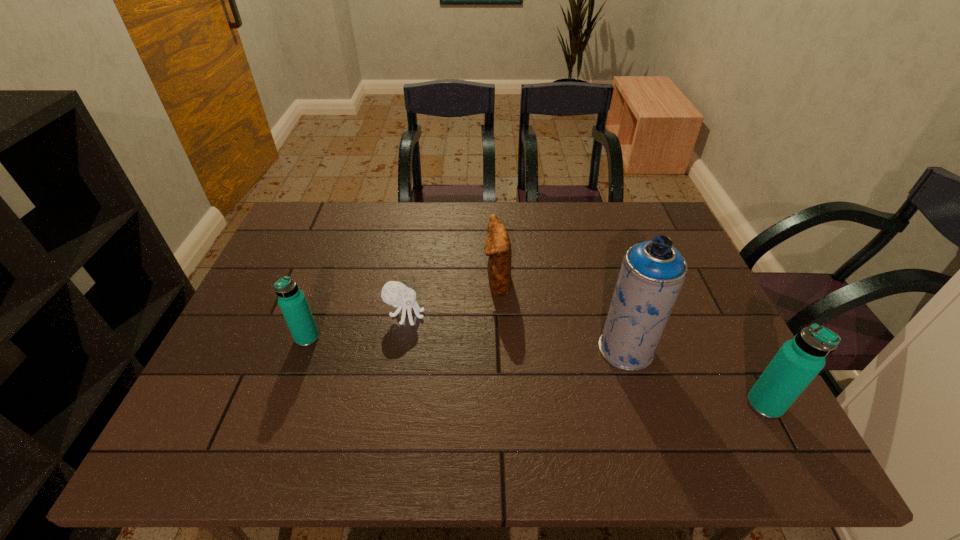
Please determine a free point for an extra water_bottle to ensure balance. Please provide its 2D coordinates. Your answer should be formatted as a tuple, i.e. [(x, y)], where the tuple contains the x and y coordinates of a point satisfying the conditions above.

[(521, 369)]